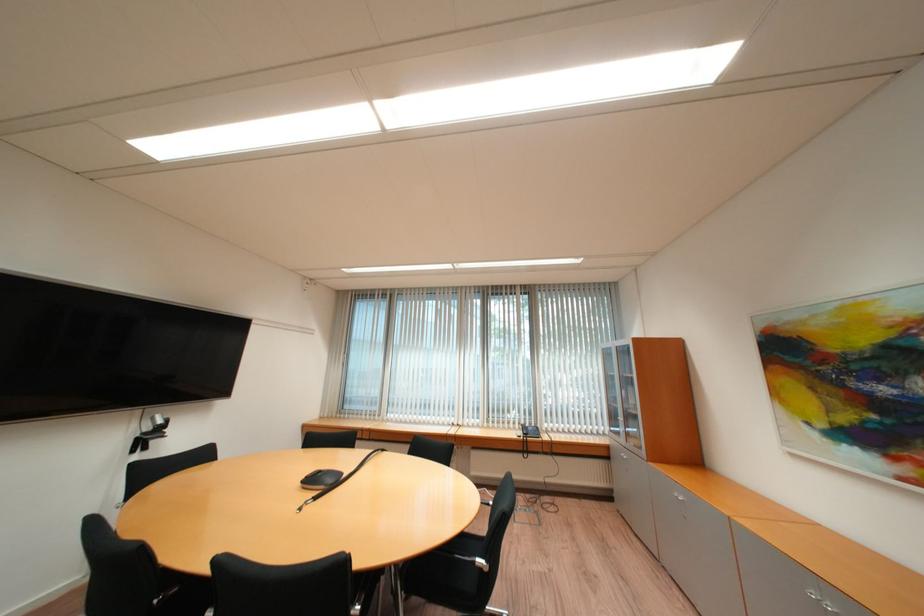
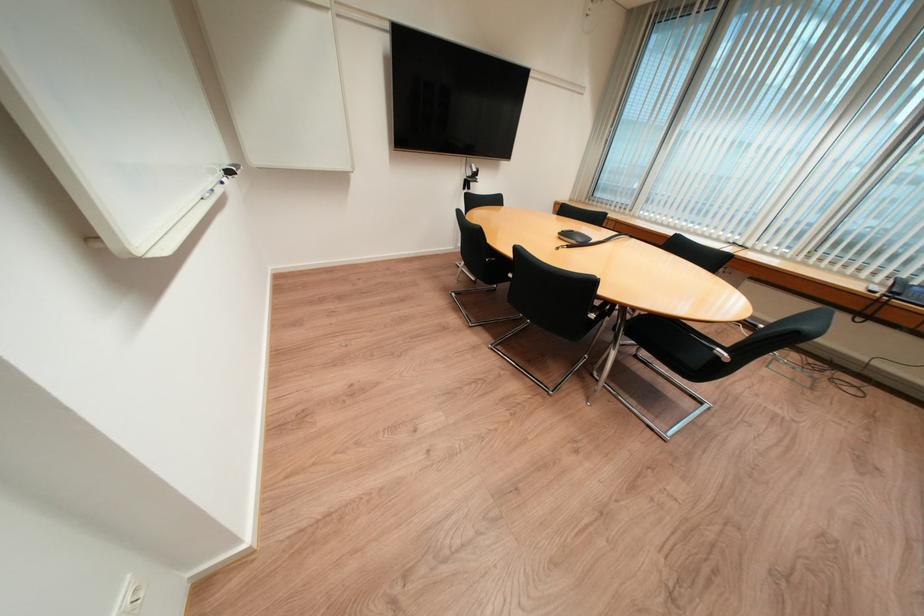
The point at (147, 440) is marked in the first image. Where is the corresponding point in the second image?

(473, 182)